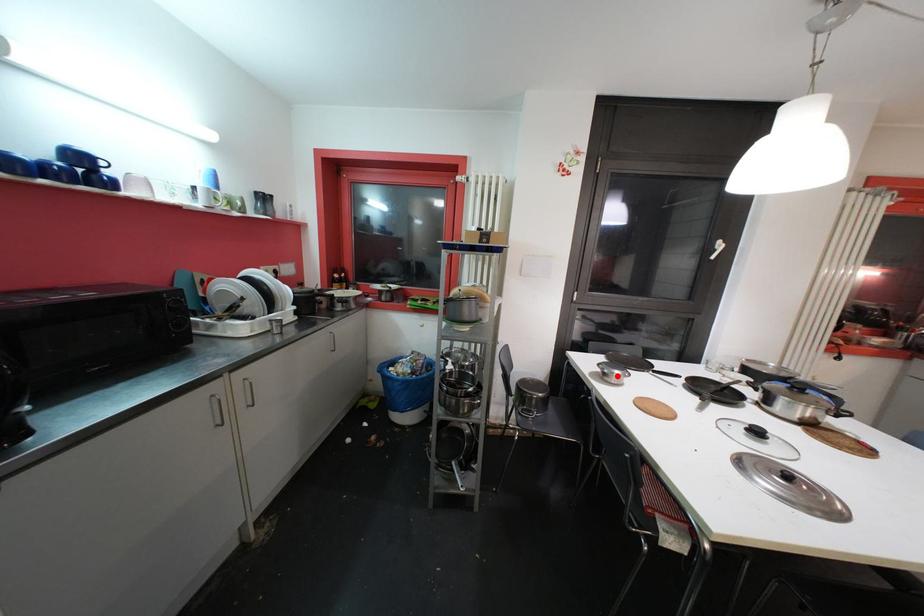
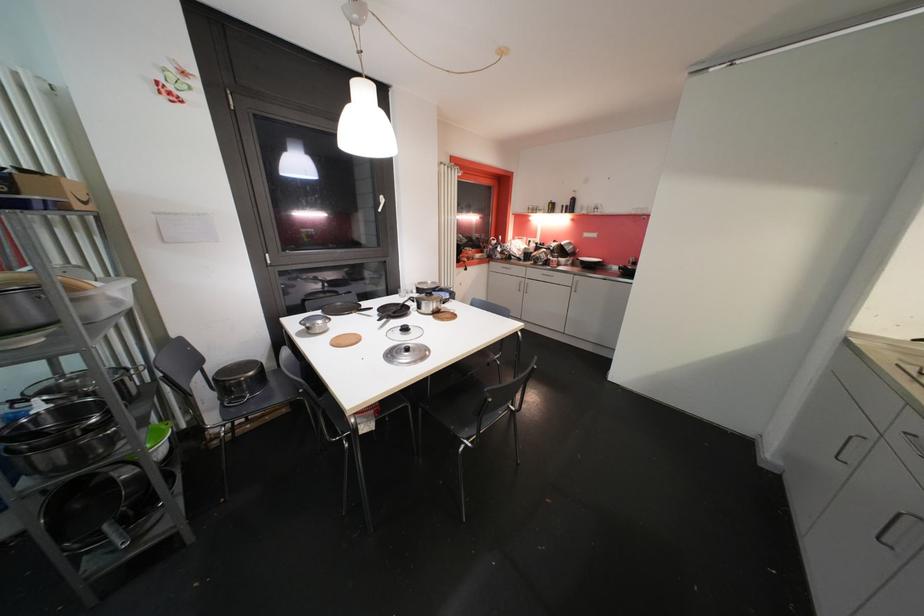
In the second image, find the point that corresponds to the highlighted location in the first image.

(319, 328)